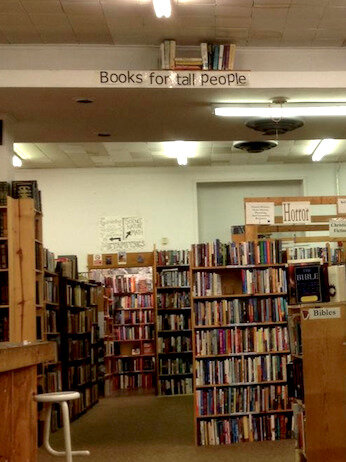
Image resolution: width=346 pixels, height=462 pixels. In order to click on light source in this screenshot , I will do pyautogui.click(x=183, y=159), pyautogui.click(x=319, y=153), pyautogui.click(x=244, y=111), pyautogui.click(x=16, y=161).